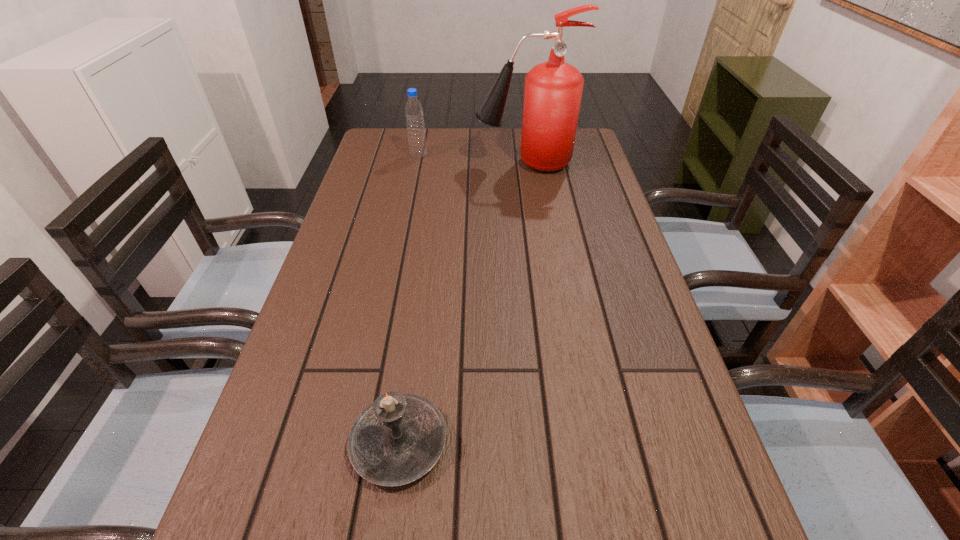
Identify the location of fire extinguisher. This screenshot has height=540, width=960. (553, 89).

This screenshot has width=960, height=540. In order to click on the tallest object in this screenshot , I will do `click(553, 89)`.

Find the location of a particular element. The height and width of the screenshot is (540, 960). the second tallest object is located at coordinates (417, 144).

Find the location of a particular element. The image size is (960, 540). candle is located at coordinates (397, 439).

I want to click on the shortest object, so click(x=397, y=439).

Where is `vacant area situated 0.270m with the nozzle aimed from the tallest object`? The image size is (960, 540). vacant area situated 0.270m with the nozzle aimed from the tallest object is located at coordinates (388, 164).

Where is `free location located with the nozzle aimed from the tallest object`? free location located with the nozzle aimed from the tallest object is located at coordinates (366, 164).

Locate an element on the screen. Image resolution: width=960 pixels, height=540 pixels. vacant area situated with the nozzle aimed from the tallest object is located at coordinates (427, 164).

Find the location of a particular element. The height and width of the screenshot is (540, 960). vacant space located on the front of the water bottle is located at coordinates (405, 221).

This screenshot has height=540, width=960. What are the coordinates of `vacant region located on the back of the nearest object` in the screenshot? It's located at (420, 287).